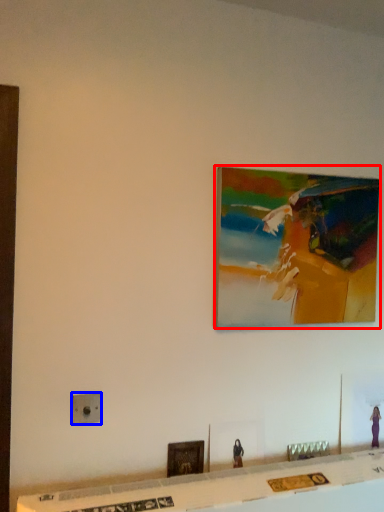
Question: Which object appears closest to the camera in this image, picture frame (highlighted by a red box) or electric outlet (highlighted by a blue box)?

Choices:
 (A) picture frame
 (B) electric outlet

Answer: (B)